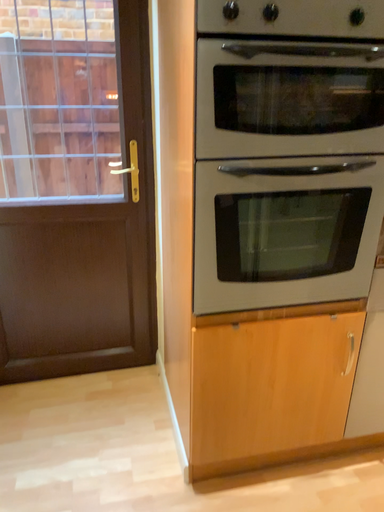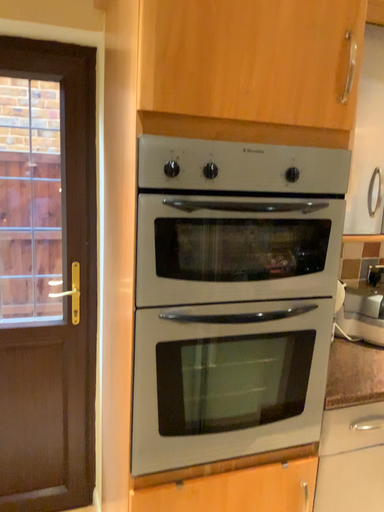
Question: How did the camera likely rotate when shooting the video?

Choices:
 (A) rotated upward
 (B) rotated downward

Answer: (A)